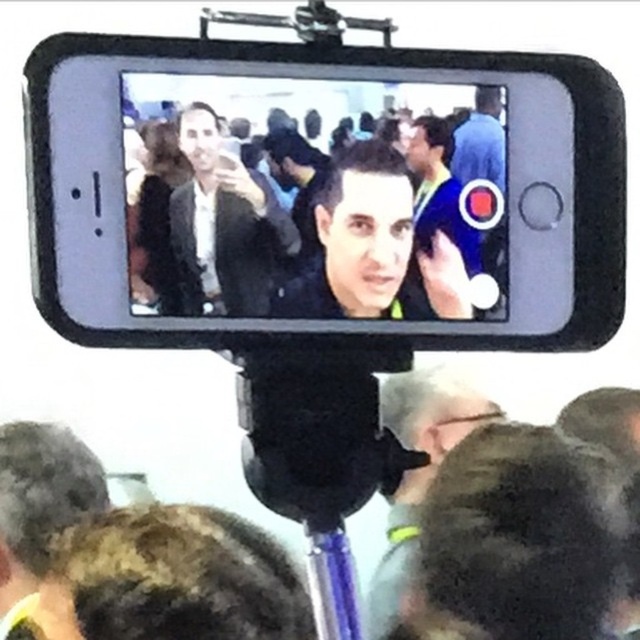
You are using a smartphone on a tripod to film a video. The screen shows a red button to start recording. There are two points on the screen at coordinates point (x=353, y=216) and point (x=54, y=428). If you want to ensure that the person in the foreground stays centered while recording, which point should you focus on?

You should focus on point (x=353, y=216) because it is in front of point (x=54, y=428), meaning it is closer to the camera and better for keeping the foreground person centered.

You are a photographer at an event and need to position your matte black phone at center and dark gray fabric jacket at lower center for a group photo. Based on their current positions, which object is closer to the left side of the frame?

The matte black phone at center is closer to the left side of the frame because it is positioned to the left of the dark gray fabric jacket at lower center.